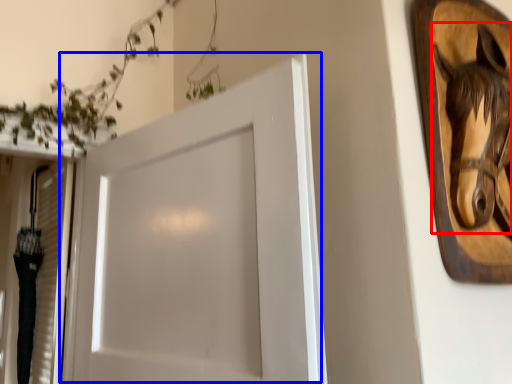
Question: Which object appears closest to the camera in this image, animal (highlighted by a red box) or door (highlighted by a blue box)?

Choices:
 (A) animal
 (B) door

Answer: (B)